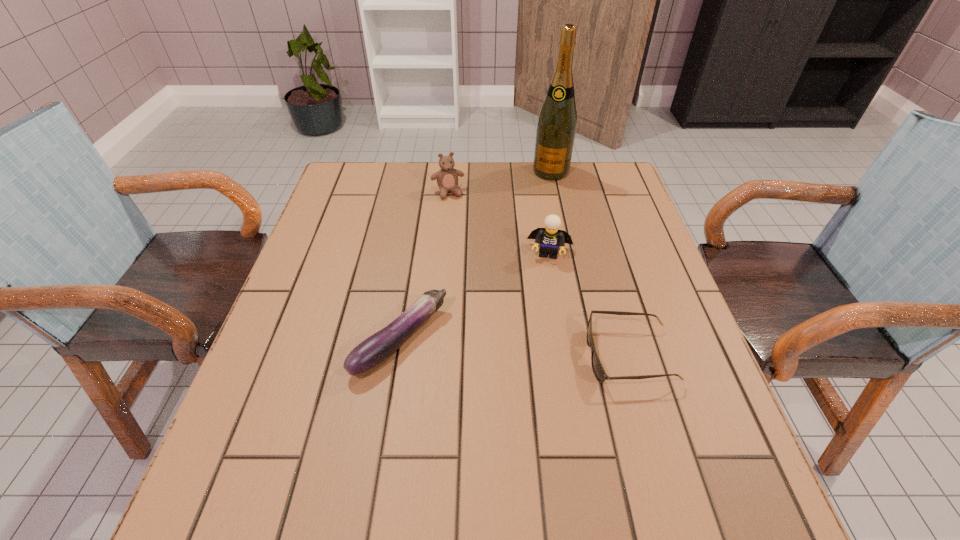
The image size is (960, 540). Find the location of `free spot on the desktop that is between the fourth tallest object and the sunglasses and is positioned on the front-facing side of the second farthest object`. free spot on the desktop that is between the fourth tallest object and the sunglasses and is positioned on the front-facing side of the second farthest object is located at coordinates (497, 347).

Where is `free space on the desktop that is between the fourth tallest object and the shortest object and is positioned on the front-facing side of the tallest object`? free space on the desktop that is between the fourth tallest object and the shortest object and is positioned on the front-facing side of the tallest object is located at coordinates (486, 347).

Find the location of a particular element. This screenshot has height=540, width=960. free spot on the desktop that is between the fourth tallest object and the shortest object and is positioned on the front-facing side of the Lego is located at coordinates (539, 350).